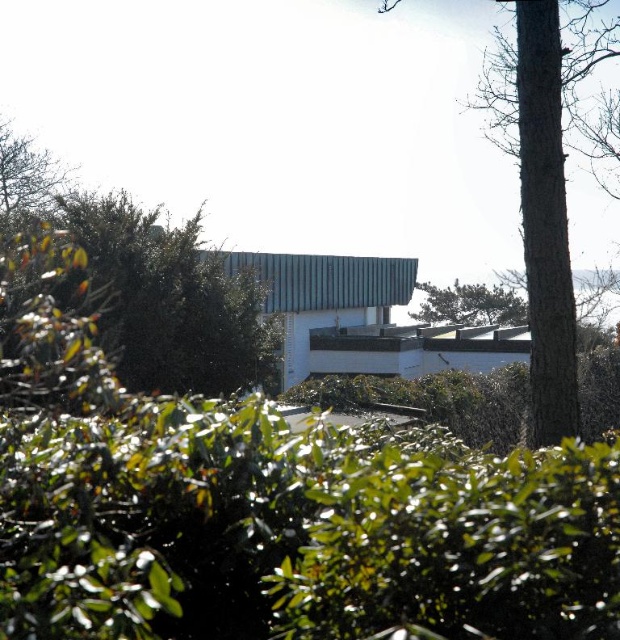
Question: Considering the relative positions of brown textured tree at center and green leafy tree at upper center in the image provided, where is brown textured tree at center located with respect to green leafy tree at upper center?

Choices:
 (A) right
 (B) left

Answer: (B)

Question: Can you confirm if brown textured tree at center is thinner than green leafy tree at upper center?

Choices:
 (A) yes
 (B) no

Answer: (B)

Question: Does brown textured tree at center appear on the right side of green leafy tree at upper center?

Choices:
 (A) yes
 (B) no

Answer: (B)